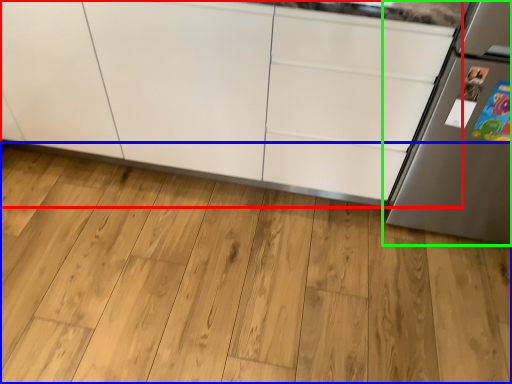
Question: Which object is the farthest from cabinetry (highlighted by a red box)? Choose among these: hardwood (highlighted by a blue box) or refrigerator (highlighted by a green box).

Choices:
 (A) hardwood
 (B) refrigerator

Answer: (B)